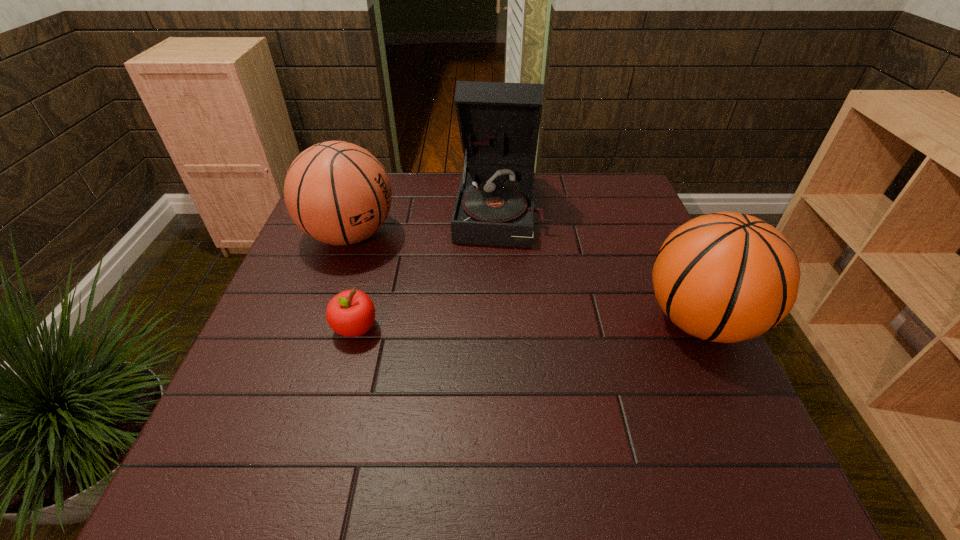
The width and height of the screenshot is (960, 540). In the image, there is a desktop. In order to click on vacant region at the far edge in this screenshot , I will do `click(578, 192)`.

Where is `vacant area at the near edge`? The height and width of the screenshot is (540, 960). vacant area at the near edge is located at coordinates (460, 422).

In order to click on vacant space at the left edge in this screenshot , I will do `click(313, 275)`.

You are a GUI agent. You are given a task and a screenshot of the screen. Output one action in this format:
    pyautogui.click(x=<x>, y=<y>)
    Task: Click on the free spot at the right edge of the desktop
    This screenshot has width=960, height=540.
    Given the screenshot: What is the action you would take?
    pyautogui.click(x=643, y=283)

Where is `blank space at the far right corner`? This screenshot has height=540, width=960. blank space at the far right corner is located at coordinates (626, 199).

The height and width of the screenshot is (540, 960). Find the location of `free space that is in between the farther basketball and the apple`. free space that is in between the farther basketball and the apple is located at coordinates (352, 281).

Find the location of a particular element. vacant area that lies between the shortest object and the right basketball is located at coordinates (528, 324).

Identify the location of vacant area that lies between the rightmost object and the shortest object. (528, 324).

Find the location of a particular element. This screenshot has height=540, width=960. free space between the rightmost object and the farther basketball is located at coordinates (525, 278).

This screenshot has height=540, width=960. I want to click on vacant space in between the apple and the phonograph_record, so pos(428,268).